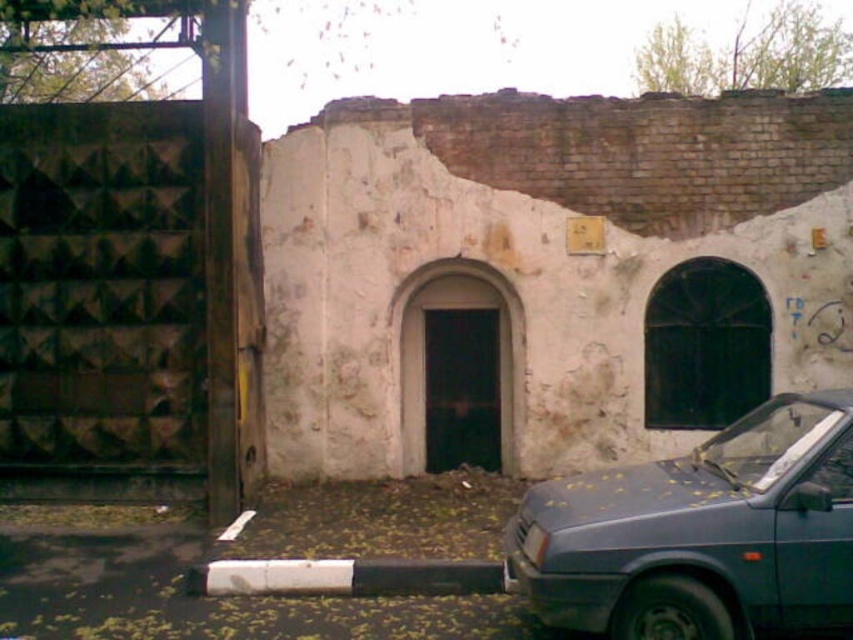
You are a parking attendant and need to ensure that the matte blue car at lower right and the white plastic license plate at center are visible in the camera feed. Since the camera has a fixed focus, which object should you adjust closer to the camera to ensure both are in focus?

Since the matte blue car at lower right is larger in size than the white plastic license plate at center, you should move the white plastic license plate at center closer to the camera to ensure both are in focus.

Consider the image. You are standing in front of the old building and see a point marked at coordinates (703, 532). Based on the scene description, can you identify what object this point is located on?

The point at (703, 532) is located on the matte blue car at lower right.